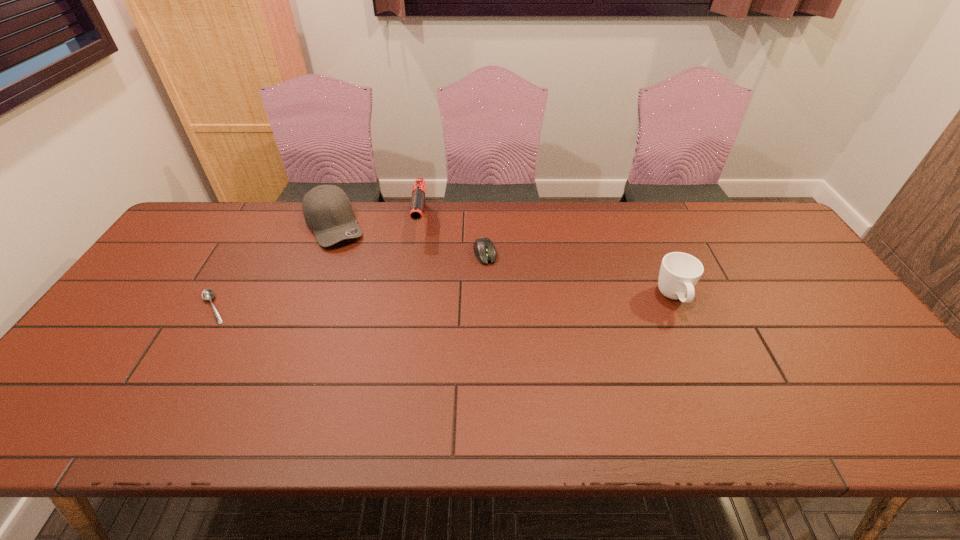
Where is `free space between the gun and the soupspoon`? The width and height of the screenshot is (960, 540). free space between the gun and the soupspoon is located at coordinates (318, 265).

At what (x,y) coordinates should I click in order to perform the action: click on blank region between the third object from left to right and the cup. Please return your answer as a coordinate pair (x, y). The height and width of the screenshot is (540, 960). Looking at the image, I should click on (547, 260).

Where is `free space between the third object from right to left and the baseball cap`? free space between the third object from right to left and the baseball cap is located at coordinates (x=378, y=224).

Find the location of a particular element. The image size is (960, 540). free spot between the soupspoon and the baseball cap is located at coordinates (275, 266).

Identify the location of free spot between the soupspoon and the third object from right to left. This screenshot has width=960, height=540. (318, 265).

Where is `vacant region between the computer mouse and the third object from left to right`? The image size is (960, 540). vacant region between the computer mouse and the third object from left to right is located at coordinates (453, 238).

I want to click on free space between the leftmost object and the second object from right to left, so click(349, 280).

Identify which object is the closest to the baseball cap. Please provide its 2D coordinates. Your answer should be formatted as a tuple, i.e. [(x, y)], where the tuple contains the x and y coordinates of a point satisfying the conditions above.

[(418, 202)]

Find the location of a particular element. object that is the third closest one to the fourth object from right to left is located at coordinates (484, 249).

Identify the location of free space that satisfies the following two spatial constraints: 1. on the back side of the shortest object; 2. on the left side of the third object from left to right. The image size is (960, 540). (263, 222).